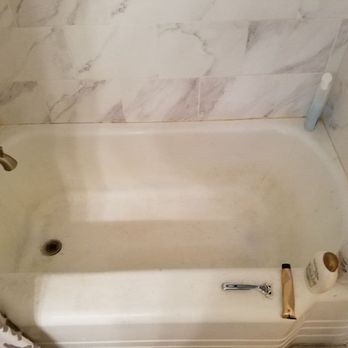
This screenshot has width=348, height=348. What are the coordinates of `bottle` in the screenshot? It's located at (316, 105).